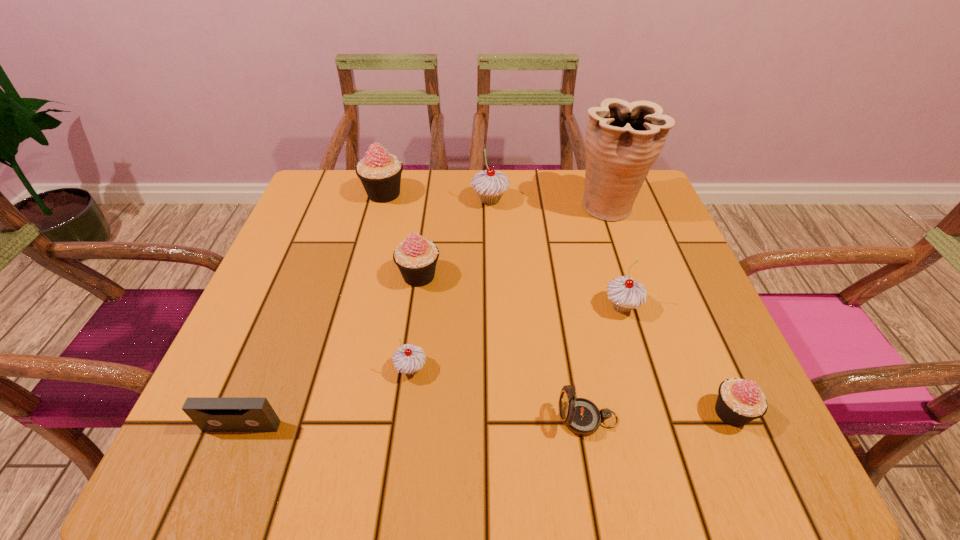
Where is `vacant space located 0.330m on the right of the second biggest pink cupcake`? vacant space located 0.330m on the right of the second biggest pink cupcake is located at coordinates (593, 276).

Find the location of a particular element. This screenshot has width=960, height=540. blank space located on the face of the compass is located at coordinates (368, 419).

Image resolution: width=960 pixels, height=540 pixels. What are the coordinates of `vacant space located on the face of the compass` in the screenshot? It's located at (527, 419).

Locate an element on the screen. free space located 0.160m on the face of the compass is located at coordinates (460, 419).

Where is `free spot located on the left of the leftmost gray cupcake`? free spot located on the left of the leftmost gray cupcake is located at coordinates (355, 369).

Find the location of `blank area located 0.150m on the left of the smallest pink cupcake`. blank area located 0.150m on the left of the smallest pink cupcake is located at coordinates (619, 413).

I want to click on vacant space located on the front-facing side of the leftmost object, so click(225, 470).

This screenshot has height=540, width=960. What are the coordinates of `urn that is at the far edge` in the screenshot? It's located at (623, 140).

Where is `compass that is positioned at the near edge`? compass that is positioned at the near edge is located at coordinates (581, 416).

Locate an element on the screen. cupcake situated at the near edge is located at coordinates pyautogui.click(x=739, y=401).